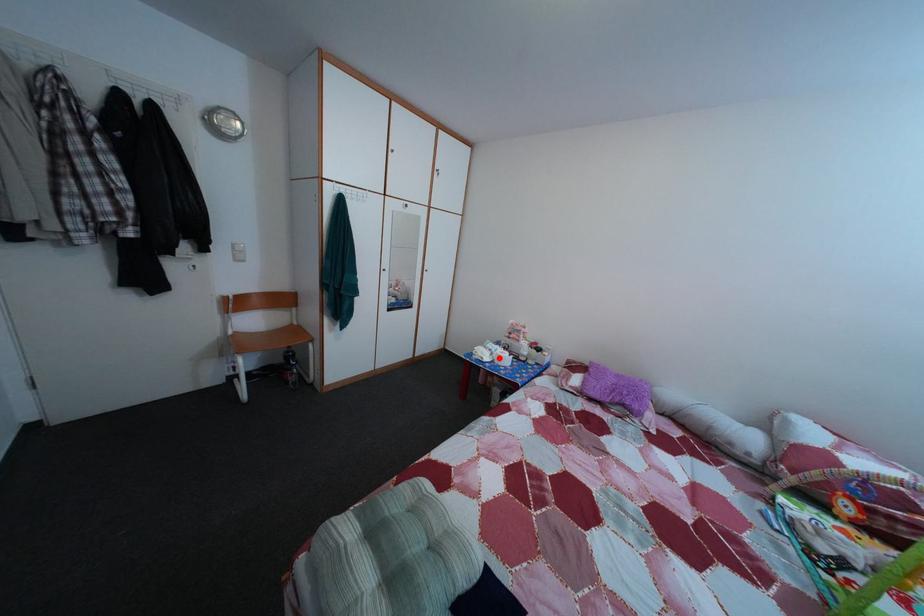
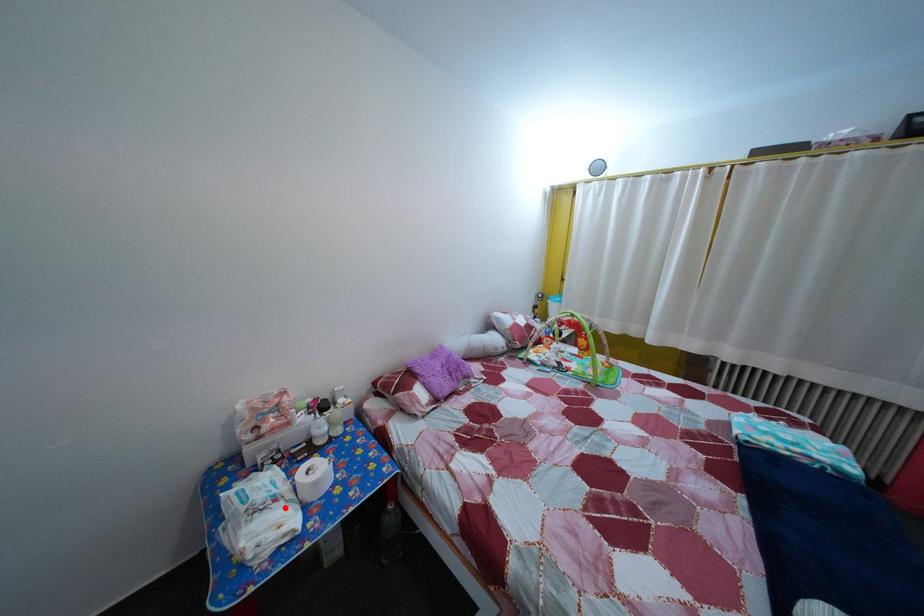
I am providing you with two images of the same scene from different viewpoints. A red point is marked on the first image and another point is marked on the second image. Is the marked point in image1 the same physical position as the marked point in image2?

Yes